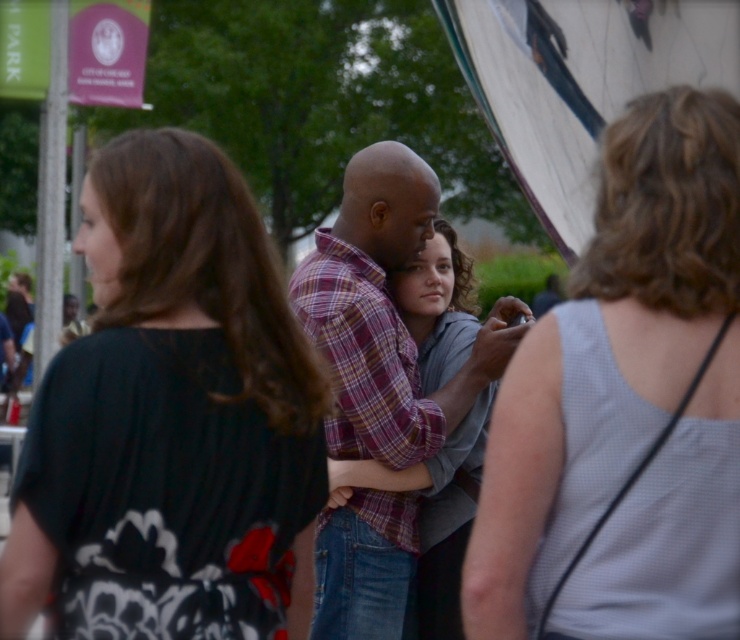
Question: Is plaid shirt at center further to camera compared to plaid cotton shirt at center?

Choices:
 (A) yes
 (B) no

Answer: (A)

Question: Is black matte dress at center further to the viewer compared to plaid shirt at center?

Choices:
 (A) no
 (B) yes

Answer: (A)

Question: Does black matte dress at center appear on the left side of plaid shirt at center?

Choices:
 (A) yes
 (B) no

Answer: (A)

Question: Which of these objects is positioned closest to the plaid cotton shirt at center?

Choices:
 (A) gray dotted tank top at right
 (B) black matte dress at center
 (C) plaid shirt at center

Answer: (C)

Question: Which point is farther to the camera?

Choices:
 (A) (376, 516)
 (B) (622, 444)
 (C) (266, 492)

Answer: (A)

Question: Which object appears closest to the camera in this image?

Choices:
 (A) gray dotted tank top at right
 (B) plaid shirt at center
 (C) black matte dress at center

Answer: (C)